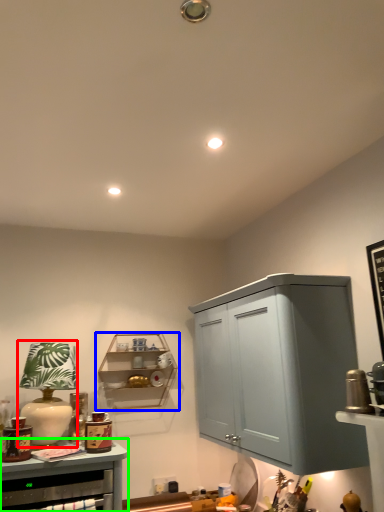
Question: Based on their relative distances, which object is nearer to table lamp (highlighted by a red box)? Choose from shelf (highlighted by a blue box) and cabinetry (highlighted by a green box).

Choices:
 (A) shelf
 (B) cabinetry

Answer: (B)